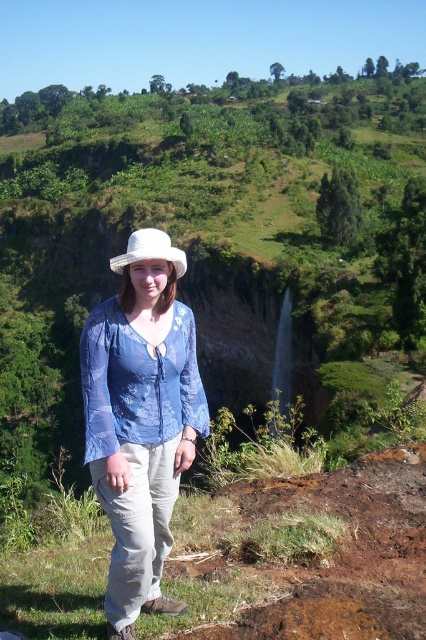
The image size is (426, 640). What do you see at coordinates (141, 419) in the screenshot? I see `matte blue blouse at center` at bounding box center [141, 419].

Can you confirm if matte blue blouse at center is bigger than white woven hat at upper center?

No, matte blue blouse at center is not bigger than white woven hat at upper center.

Identify the location of matte blue blouse at center. (141, 419).